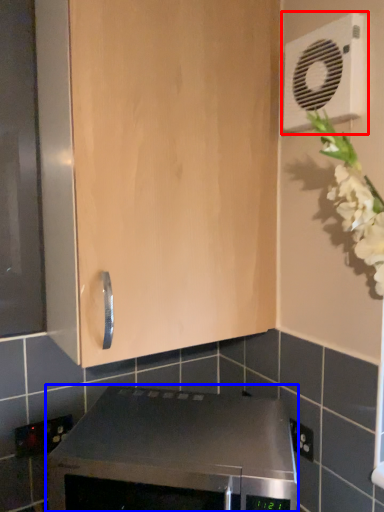
Question: Which point is closer to the camera, air conditioning (highlighted by a red box) or home appliance (highlighted by a blue box)?

Choices:
 (A) air conditioning
 (B) home appliance

Answer: (B)